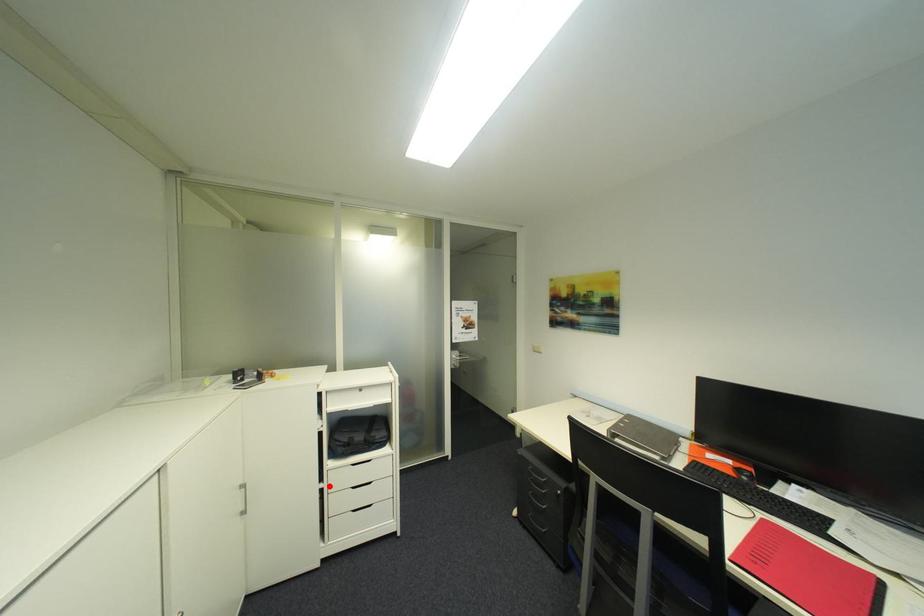
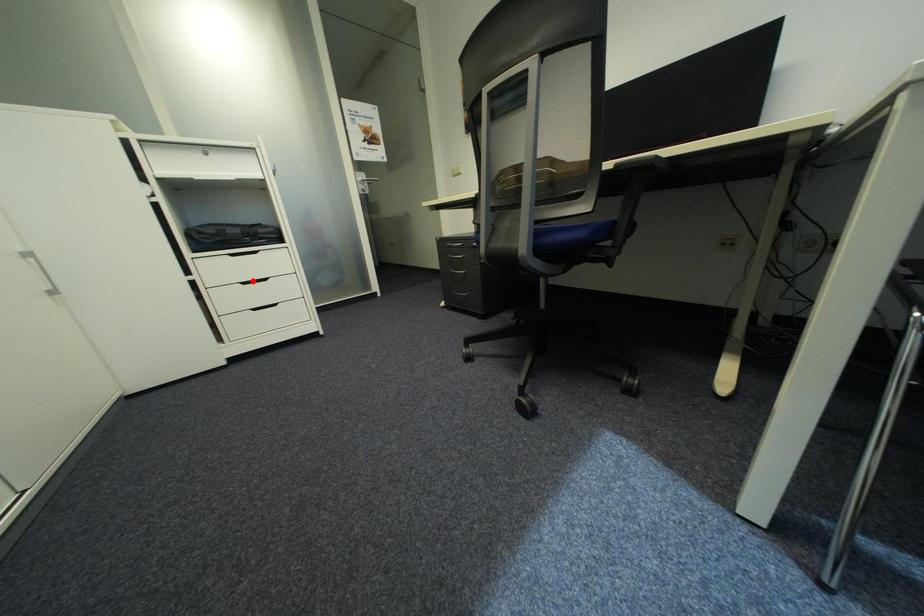
I am providing you with two images of the same scene from different viewpoints. A red point is marked on the first image and another point is marked on the second image. Do the highlighted points in image1 and image2 indicate the same real-world spot?

No